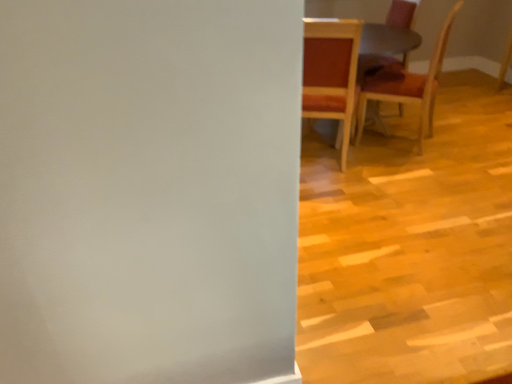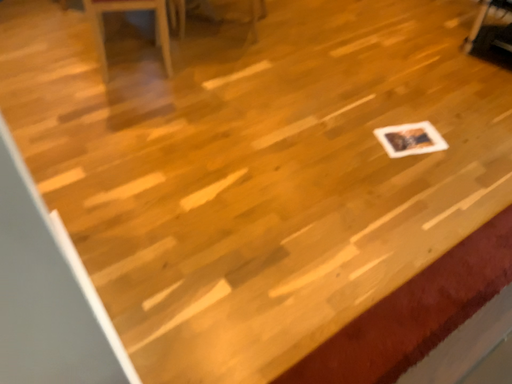
Question: Which way did the camera rotate in the video?

Choices:
 (A) rotated right
 (B) rotated left

Answer: (A)